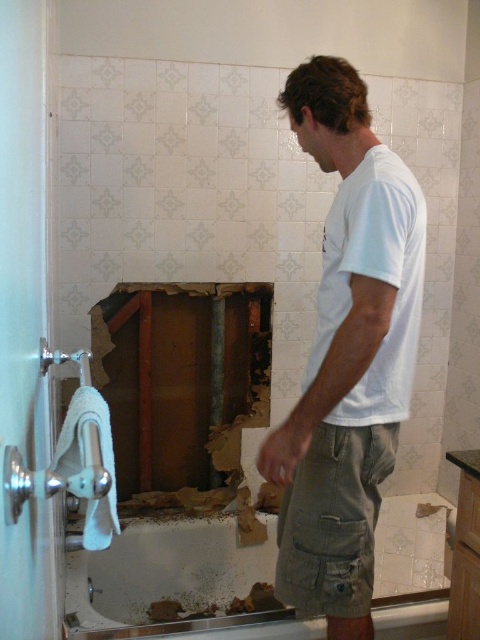
This screenshot has width=480, height=640. In order to click on white cotton t-shirt at center in this screenshot , I will do `click(347, 355)`.

Does white cotton t-shirt at center have a lesser width compared to khaki cotton shorts at center?

No.

Does point (333, 129) lie in front of point (326, 467)?

No, (333, 129) is behind (326, 467).

The height and width of the screenshot is (640, 480). I want to click on white cotton t-shirt at center, so click(347, 355).